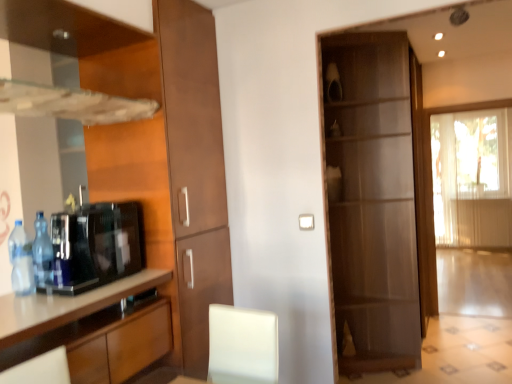
Identify the location of unoccupied area in front of blue plastic bottle at left, which is counted as the first bottle, starting from the back. (30, 298).